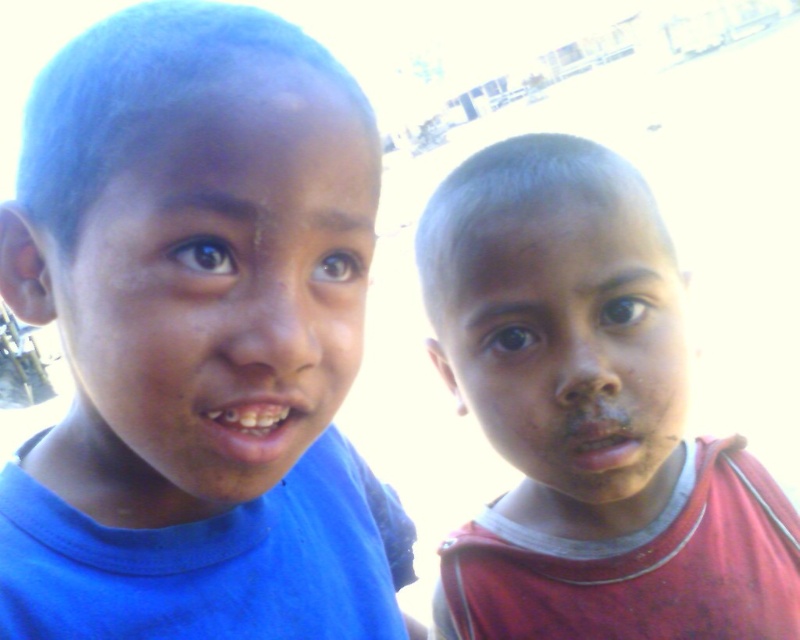
Question: Can you confirm if blue matte face at left is bigger than dull skin face at right?

Choices:
 (A) no
 (B) yes

Answer: (A)

Question: Which of the following is the farthest from the observer?

Choices:
 (A) tap(254, 444)
 (B) tap(336, 120)
 (C) tap(758, 637)

Answer: (C)

Question: Is blue matte shirt at left above blue matte face at left?

Choices:
 (A) no
 (B) yes

Answer: (A)

Question: Which point is farther from the camera taking this photo?

Choices:
 (A) (308, 257)
 (B) (545, 401)

Answer: (B)

Question: Is blue matte shirt at left thinner than matte red shirt at right?

Choices:
 (A) no
 (B) yes

Answer: (B)

Question: Which object appears farthest from the camera in this image?

Choices:
 (A) blue matte shirt at left
 (B) dull skin face at right
 (C) matte red shirt at right

Answer: (C)